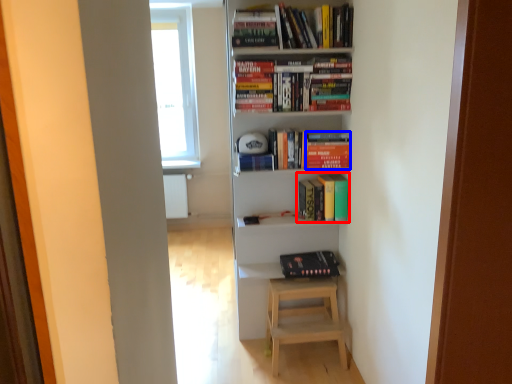
Question: Among these objects, which one is nearest to the camera, book (highlighted by a red box) or paperback book (highlighted by a blue box)?

Choices:
 (A) book
 (B) paperback book

Answer: (B)